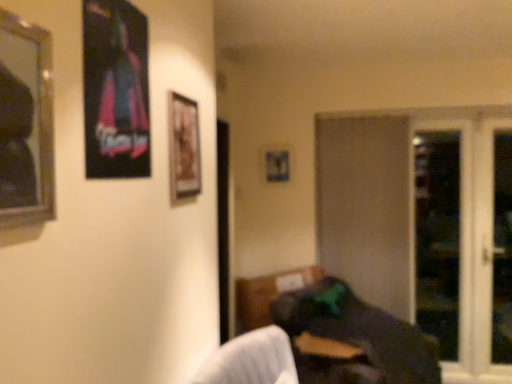
What do you see at coordinates (115, 90) in the screenshot?
I see `metallic poster at upper left, the second picture frame in the left-to-right sequence` at bounding box center [115, 90].

Describe the element at coordinates (277, 166) in the screenshot. This screenshot has height=384, width=512. I see `metallic silver picture frame at center, acting as the 1th picture frame starting from the back` at that location.

You are a GUI agent. You are given a task and a screenshot of the screen. Output one action in this format:
    pyautogui.click(x=<x>, y=<y>)
    Task: Click on the beige matte screen door at center-right, the 4th screen door in the right-to-left sequence
    
    Given the screenshot: What is the action you would take?
    pyautogui.click(x=367, y=207)

Where is `white glass screen door at right, the 1th screen door positioned from the right`? white glass screen door at right, the 1th screen door positioned from the right is located at coordinates (487, 251).

I want to click on wooden framed picture at center, the 3th picture frame positioned from the left, so click(183, 148).

Image resolution: width=512 pixels, height=384 pixels. What are the coordinates of `metallic poster at upper left, placed as the third picture frame when sorted from back to front` in the screenshot? It's located at (115, 90).

Is metallic silver picture frame at center, the fourth picture frame positioned from the left, inside the boundaries of transparent glass screen door at right, marked as the second screen door in a left-to-right arrangement, or outside?

metallic silver picture frame at center, the fourth picture frame positioned from the left, is spatially situated outside transparent glass screen door at right, marked as the second screen door in a left-to-right arrangement.

From the image's perspective, is metallic silver picture frame at center, acting as the fourth picture frame starting from the front, located above or below transparent glass screen door at right, marked as the second screen door in a left-to-right arrangement?

metallic silver picture frame at center, acting as the fourth picture frame starting from the front, is situated higher than transparent glass screen door at right, marked as the second screen door in a left-to-right arrangement, in the image.

Considering the sizes of objects metallic silver picture frame at center, acting as the fourth picture frame starting from the front, and transparent glass screen door at right, the 3th screen door positioned from the right, in the image provided, who is smaller, metallic silver picture frame at center, acting as the fourth picture frame starting from the front, or transparent glass screen door at right, the 3th screen door positioned from the right,?

Smaller between the two is metallic silver picture frame at center, acting as the fourth picture frame starting from the front.

Is silver-framed mirror at left, which is the first picture frame from front to back, smaller than white glass screen door at right, arranged as the 4th screen door when viewed from the left?

Indeed, silver-framed mirror at left, which is the first picture frame from front to back, has a smaller size compared to white glass screen door at right, arranged as the 4th screen door when viewed from the left.

From the image's perspective, which one is positioned lower, silver-framed mirror at left, arranged as the 4th picture frame when viewed from the back, or white glass screen door at right, the 1th screen door positioned from the right?

From the image's view, white glass screen door at right, the 1th screen door positioned from the right, is below.

Can you tell me how much silver-framed mirror at left, arranged as the first picture frame when viewed from the left, and white glass screen door at right, arranged as the 4th screen door when viewed from the left, differ in facing direction?

The angular difference between silver-framed mirror at left, arranged as the first picture frame when viewed from the left, and white glass screen door at right, arranged as the 4th screen door when viewed from the left, is 90 degrees.

Between point (14, 61) and point (502, 196), which one is positioned behind?

The point (502, 196) is farther from the camera.

Can you see beige matte screen door at center-right, which ranks as the 1th screen door in left-to-right order, touching transparent glass screen door at right, acting as the third screen door starting from the left?

No, beige matte screen door at center-right, which ranks as the 1th screen door in left-to-right order, is not beside transparent glass screen door at right, acting as the third screen door starting from the left.

Is beige matte screen door at center-right, the 4th screen door in the right-to-left sequence, behind transparent glass screen door at right, acting as the third screen door starting from the left?

No, beige matte screen door at center-right, the 4th screen door in the right-to-left sequence, is closer to the camera.

From the image's perspective, between beige matte screen door at center-right, which ranks as the 1th screen door in left-to-right order, and transparent glass screen door at right, the 2th screen door positioned from the right, who is located below?

transparent glass screen door at right, the 2th screen door positioned from the right.

Can you tell me how much beige matte screen door at center-right, which ranks as the 1th screen door in left-to-right order, and transparent glass screen door at right, the 2th screen door positioned from the right, differ in facing direction?

There is a 0.00313-degree angle between the facing directions of beige matte screen door at center-right, which ranks as the 1th screen door in left-to-right order, and transparent glass screen door at right, the 2th screen door positioned from the right.

From a real-world perspective, is dark fabric bean bag at lower right located beneath metallic silver picture frame at center, acting as the fourth picture frame starting from the front?

Yes, from a real-world perspective, dark fabric bean bag at lower right is beneath metallic silver picture frame at center, acting as the fourth picture frame starting from the front.

Is dark fabric bean bag at lower right taller than metallic silver picture frame at center, the fourth picture frame positioned from the left?

Yes.

Would you say dark fabric bean bag at lower right is inside or outside metallic silver picture frame at center, acting as the fourth picture frame starting from the front?

dark fabric bean bag at lower right exists outside the volume of metallic silver picture frame at center, acting as the fourth picture frame starting from the front.

Which object is closer to the camera taking this photo, dark fabric bean bag at lower right or metallic silver picture frame at center, acting as the fourth picture frame starting from the front?

dark fabric bean bag at lower right is in front.

From the image's perspective, is metallic silver picture frame at center, which is the first picture frame from right to left, located above or below wooden framed picture at center, which is counted as the 2th picture frame, starting from the right?

metallic silver picture frame at center, which is the first picture frame from right to left, is situated higher than wooden framed picture at center, which is counted as the 2th picture frame, starting from the right, in the image.

From a real-world perspective, between metallic silver picture frame at center, which is the first picture frame from right to left, and wooden framed picture at center, the 3th picture frame positioned from the left, who is vertically lower?

metallic silver picture frame at center, which is the first picture frame from right to left, from a real-world perspective.

Which object is positioned more to the right, metallic silver picture frame at center, the fourth picture frame positioned from the left, or wooden framed picture at center, arranged as the third picture frame when viewed from the front?

Positioned to the right is metallic silver picture frame at center, the fourth picture frame positioned from the left.

Does point (275, 160) come closer to viewer compared to point (180, 147)?

No, it is behind (180, 147).

Can you see white glass screen door at right, arranged as the 4th screen door when viewed from the left, touching silver-framed mirror at left, which is the first picture frame from front to back?

white glass screen door at right, arranged as the 4th screen door when viewed from the left, is not next to silver-framed mirror at left, which is the first picture frame from front to back, and they're not touching.

Considering the relative sizes of white glass screen door at right, the 1th screen door positioned from the right, and silver-framed mirror at left, arranged as the 4th picture frame when viewed from the back, in the image provided, is white glass screen door at right, the 1th screen door positioned from the right, wider than silver-framed mirror at left, arranged as the 4th picture frame when viewed from the back,?

Yes, white glass screen door at right, the 1th screen door positioned from the right, is wider than silver-framed mirror at left, arranged as the 4th picture frame when viewed from the back.

From a real-world perspective, is white glass screen door at right, the 1th screen door positioned from the right, positioned above or below silver-framed mirror at left, arranged as the first picture frame when viewed from the left?

white glass screen door at right, the 1th screen door positioned from the right, is below silver-framed mirror at left, arranged as the first picture frame when viewed from the left.

Considering the sizes of objects white glass screen door at right, arranged as the 4th screen door when viewed from the left, and silver-framed mirror at left, arranged as the 4th picture frame when viewed from the back, in the image provided, who is shorter, white glass screen door at right, arranged as the 4th screen door when viewed from the left, or silver-framed mirror at left, arranged as the 4th picture frame when viewed from the back,?

silver-framed mirror at left, arranged as the 4th picture frame when viewed from the back, is shorter.

From a real-world perspective, is silver-framed mirror at left, which is the first picture frame from front to back, located beneath transparent glass screen door at right, marked as the second screen door in a left-to-right arrangement?

Actually, silver-framed mirror at left, which is the first picture frame from front to back, is physically above transparent glass screen door at right, marked as the second screen door in a left-to-right arrangement, in the real world.

Consider the image. Is silver-framed mirror at left, arranged as the first picture frame when viewed from the left, taller or shorter than transparent glass screen door at right, marked as the second screen door in a left-to-right arrangement?

silver-framed mirror at left, arranged as the first picture frame when viewed from the left, is shorter than transparent glass screen door at right, marked as the second screen door in a left-to-right arrangement.

How different are the orientations of silver-framed mirror at left, arranged as the first picture frame when viewed from the left, and transparent glass screen door at right, the 3th screen door positioned from the right, in degrees?

The angle between the facing direction of silver-framed mirror at left, arranged as the first picture frame when viewed from the left, and the facing direction of transparent glass screen door at right, the 3th screen door positioned from the right, is 90 degrees.

Which is more to the right, silver-framed mirror at left, which is the first picture frame from front to back, or transparent glass screen door at right, the 3th screen door positioned from the right?

Positioned to the right is transparent glass screen door at right, the 3th screen door positioned from the right.

The height and width of the screenshot is (384, 512). There is a metallic silver picture frame at center, acting as the 1th picture frame starting from the back. Identify the location of the 4th screen door below it (from the image's perspective). (425, 225).

I want to click on the 3rd picture frame in front of the white glass screen door at right, arranged as the 4th screen door when viewed from the left, so click(25, 123).

When comparing their distances from transparent glass screen door at right, the 2th screen door positioned from the right, does white glass screen door at right, arranged as the 4th screen door when viewed from the left, or beige matte screen door at center-right, the 4th screen door in the right-to-left sequence, seem further?

beige matte screen door at center-right, the 4th screen door in the right-to-left sequence.

Looking at the image, which one is located further to wooden framed picture at center, which is counted as the 2th picture frame, starting from the right, metallic poster at upper left, placed as the third picture frame when sorted from back to front, or metallic silver picture frame at center, acting as the 1th picture frame starting from the back?

metallic silver picture frame at center, acting as the 1th picture frame starting from the back, is further to wooden framed picture at center, which is counted as the 2th picture frame, starting from the right.

Estimate the real-world distances between objects in this image. Which object is further from metallic silver picture frame at center, the fourth picture frame positioned from the left, metallic poster at upper left, the second picture frame in the left-to-right sequence, or beige matte screen door at center-right, which ranks as the 1th screen door in left-to-right order?

metallic poster at upper left, the second picture frame in the left-to-right sequence, is positioned further to the anchor metallic silver picture frame at center, the fourth picture frame positioned from the left.

Based on their spatial positions, is transparent glass screen door at right, the 2th screen door positioned from the right, or silver-framed mirror at left, arranged as the 4th picture frame when viewed from the back, closer to wooden framed picture at center, positioned as the 2th picture frame in back-to-front order?

silver-framed mirror at left, arranged as the 4th picture frame when viewed from the back, is closer to wooden framed picture at center, positioned as the 2th picture frame in back-to-front order.

When comparing their distances from wooden framed picture at center, which is counted as the 2th picture frame, starting from the right, does beige matte screen door at center-right, the 4th screen door in the right-to-left sequence, or metallic silver picture frame at center, which is the first picture frame from right to left, seem closer?

metallic silver picture frame at center, which is the first picture frame from right to left, is positioned closer to the anchor wooden framed picture at center, which is counted as the 2th picture frame, starting from the right.

Estimate the real-world distances between objects in this image. Which object is further from beige matte screen door at center-right, the 4th screen door in the right-to-left sequence, silver-framed mirror at left, which is the first picture frame from front to back, or metallic poster at upper left, the second picture frame in the left-to-right sequence?

Based on the image, silver-framed mirror at left, which is the first picture frame from front to back, appears to be further to beige matte screen door at center-right, the 4th screen door in the right-to-left sequence.

Estimate the real-world distances between objects in this image. Which object is closer to white glass screen door at right, the 1th screen door positioned from the right, metallic silver picture frame at center, the fourth picture frame positioned from the left, or silver-framed mirror at left, arranged as the 4th picture frame when viewed from the back?

Based on the image, metallic silver picture frame at center, the fourth picture frame positioned from the left, appears to be nearer to white glass screen door at right, the 1th screen door positioned from the right.

Considering their positions, is wooden framed picture at center, which is counted as the 2th picture frame, starting from the right, positioned closer to transparent glass screen door at right, the 2th screen door positioned from the right, than dark fabric bean bag at lower right?

Based on the image, dark fabric bean bag at lower right appears to be nearer to transparent glass screen door at right, the 2th screen door positioned from the right.

At what (x,y) coordinates should I click in order to perform the action: click on bean bag chair located between silver-framed mirror at left, positioned as the 4th picture frame in right-to-left order, and white glass screen door at right, arranged as the 4th screen door when viewed from the left, in the depth direction. Please return your answer as a coordinate pair (x, y). The image size is (512, 384). Looking at the image, I should click on (354, 338).

Locate an element on the screen. Image resolution: width=512 pixels, height=384 pixels. bean bag chair positioned between metallic poster at upper left, placed as the third picture frame when sorted from back to front, and beige matte screen door at center-right, which ranks as the 1th screen door in left-to-right order, from near to far is located at coordinates (354, 338).

The height and width of the screenshot is (384, 512). I want to click on picture frame between metallic poster at upper left, the second picture frame in the left-to-right sequence, and metallic silver picture frame at center, which is the first picture frame from right to left, in the front-back direction, so click(x=183, y=148).

The width and height of the screenshot is (512, 384). I want to click on bean bag chair between metallic poster at upper left, placed as the third picture frame when sorted from back to front, and metallic silver picture frame at center, acting as the 1th picture frame starting from the back, in the front-back direction, so click(x=354, y=338).